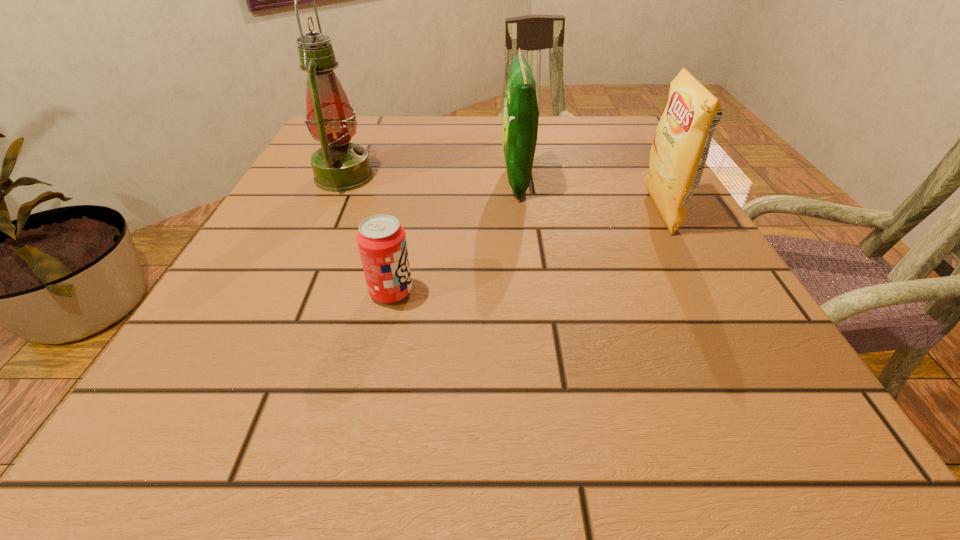
Find the location of `the leftmost object`. the leftmost object is located at coordinates (339, 166).

Where is `the tallest object`? The width and height of the screenshot is (960, 540). the tallest object is located at coordinates (x=339, y=166).

You are a GUI agent. You are given a task and a screenshot of the screen. Output one action in this format:
    pyautogui.click(x=<x>, y=<y>)
    Task: Click on the right crisp (potato chip)
    This screenshot has height=540, width=960.
    Given the screenshot: What is the action you would take?
    pyautogui.click(x=680, y=148)

Where is `the left crisp (potato chip)`? The image size is (960, 540). the left crisp (potato chip) is located at coordinates pyautogui.click(x=520, y=114).

This screenshot has height=540, width=960. I want to click on soda can, so click(x=381, y=240).

Where is `the shortest object`? The width and height of the screenshot is (960, 540). the shortest object is located at coordinates (381, 240).

Where is `blank area located 0.090m on the right of the tallest object`? This screenshot has width=960, height=540. blank area located 0.090m on the right of the tallest object is located at coordinates (416, 177).

You are a GUI agent. You are given a task and a screenshot of the screen. Output one action in this format:
    pyautogui.click(x=<x>, y=<y>)
    Task: Click on the vacant area situated on the front of the right crisp (potato chip) with the logo
    
    Given the screenshot: What is the action you would take?
    pyautogui.click(x=614, y=213)

What are the coordinates of `vacant space located on the front of the right crisp (potato chip) with the logo` in the screenshot? It's located at (502, 213).

Where is `free space located on the front of the right crisp (potato chip) with the logo`? This screenshot has width=960, height=540. free space located on the front of the right crisp (potato chip) with the logo is located at coordinates (487, 213).